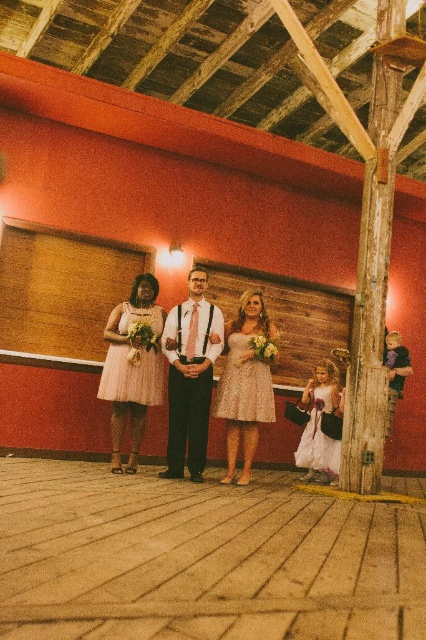
Does pink tulle dress at center have a larger size compared to glittery lace dress at center?

Yes, pink tulle dress at center is bigger than glittery lace dress at center.

Who is more forward, (118, 442) or (247, 337)?

Point (247, 337) is more forward.

Identify the location of pink tulle dress at center. Image resolution: width=426 pixels, height=640 pixels. (169, 371).

Does pink satin dress at center appear under glittery lace dress at center?

No.

Is point (143, 358) closer to viewer compared to point (258, 316)?

Yes, it is.

Which is behind, point (154, 330) or point (268, 400)?

Positioned behind is point (154, 330).

Find the location of `pink satin dress at center`. pink satin dress at center is located at coordinates (132, 365).

Between pink satin dress at center and light pink satin dress at center, which one appears on the left side from the viewer's perspective?

Positioned to the left is pink satin dress at center.

The height and width of the screenshot is (640, 426). Find the location of `pink satin dress at center`. pink satin dress at center is located at coordinates (132, 365).

What do you see at coordinates (132, 365) in the screenshot? This screenshot has width=426, height=640. I see `pink satin dress at center` at bounding box center [132, 365].

You are a GUI agent. You are given a task and a screenshot of the screen. Output one action in this format:
    pyautogui.click(x=<x>, y=<y>)
    Task: Click on the pink satin dress at center
    
    Given the screenshot: What is the action you would take?
    pyautogui.click(x=132, y=365)